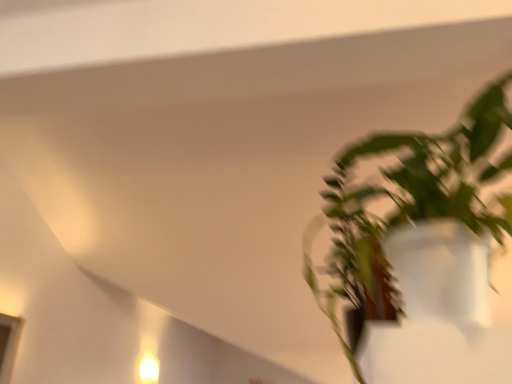
Question: Is green matte plant at right wider than white glossy light fixture at lower left?

Choices:
 (A) no
 (B) yes

Answer: (B)

Question: Is there a large distance between green matte plant at right and white glossy light fixture at lower left?

Choices:
 (A) yes
 (B) no

Answer: (A)

Question: From the image's perspective, is green matte plant at right beneath white glossy light fixture at lower left?

Choices:
 (A) yes
 (B) no

Answer: (B)

Question: Is green matte plant at right with white glossy light fixture at lower left?

Choices:
 (A) yes
 (B) no

Answer: (B)

Question: Is green matte plant at right outside of white glossy light fixture at lower left?

Choices:
 (A) no
 (B) yes

Answer: (B)

Question: From a real-world perspective, does green matte plant at right sit lower than white glossy light fixture at lower left?

Choices:
 (A) yes
 (B) no

Answer: (B)

Question: Is white glossy light fixture at lower left to the right of green matte plant at right from the viewer's perspective?

Choices:
 (A) no
 (B) yes

Answer: (A)

Question: Does white glossy light fixture at lower left have a greater width compared to green matte plant at right?

Choices:
 (A) no
 (B) yes

Answer: (A)

Question: Is white glossy light fixture at lower left positioned beyond the bounds of green matte plant at right?

Choices:
 (A) yes
 (B) no

Answer: (A)

Question: From the image's perspective, is white glossy light fixture at lower left located above green matte plant at right?

Choices:
 (A) no
 (B) yes

Answer: (A)

Question: Is white glossy light fixture at lower left taller than green matte plant at right?

Choices:
 (A) no
 (B) yes

Answer: (A)

Question: From a real-world perspective, is white glossy light fixture at lower left located beneath green matte plant at right?

Choices:
 (A) no
 (B) yes

Answer: (B)

Question: In the image, is green matte plant at right positioned in front of or behind white glossy light fixture at lower left?

Choices:
 (A) front
 (B) behind

Answer: (A)